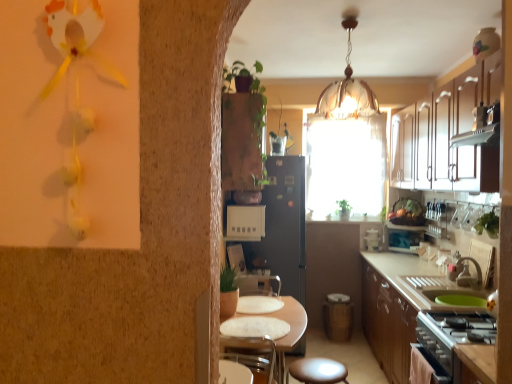
Question: Considering the positions of stainless steel stove at lower right and white textured table at center in the image, is stainless steel stove at lower right wider or thinner than white textured table at center?

Choices:
 (A) thin
 (B) wide

Answer: (A)

Question: Would you say stainless steel stove at lower right is inside or outside white textured table at center?

Choices:
 (A) outside
 (B) inside

Answer: (A)

Question: Considering the real-world distances, which object is farthest from the green leafy plant at right, the 1th plant when ordered from bottom to top?

Choices:
 (A) white glossy cabinet at upper right
 (B) matte brown stool at lower center
 (C) white textured table at center
 (D) white glossy countertop at lower right
 (E) stainless steel stove at lower right

Answer: (C)

Question: Estimate the real-world distances between objects in this image. Which object is closer to the stainless steel stove at lower right?

Choices:
 (A) green leafy plant at right, the 1th plant when ordered from bottom to top
 (B) beige plastic electrical outlet at center, the second appliance positioned from the bottom
 (C) black matte refrigerator at center
 (D) white glossy cabinet at upper right
 (E) matte black microwave at right, positioned as the second appliance in top-to-bottom order

Answer: (A)